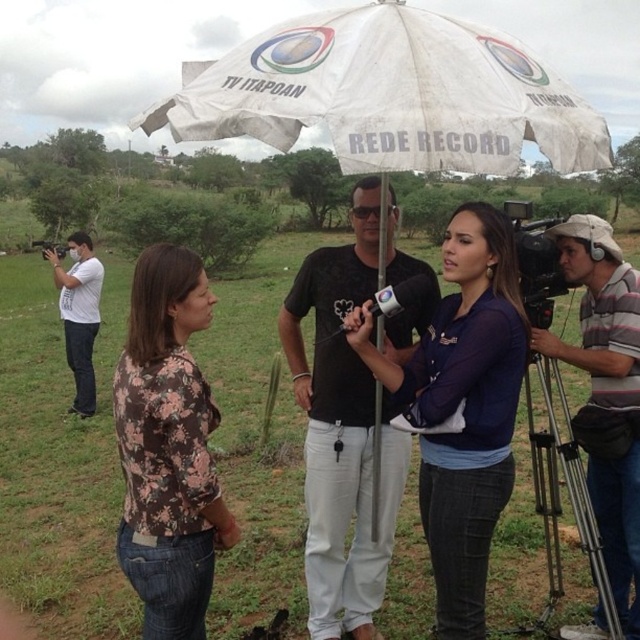
Question: Which of the following is the farthest from the observer?

Choices:
 (A) (506, 412)
 (B) (67, 248)
 (C) (365, 481)

Answer: (B)

Question: Is black matte t-shirt at center below black plastic video camera at left?

Choices:
 (A) no
 (B) yes

Answer: (B)

Question: Is white matte camera at left wider than black plastic video camera at right?

Choices:
 (A) no
 (B) yes

Answer: (B)

Question: Which point is closer to the camera?

Choices:
 (A) black plastic video camera at right
 (B) black plastic video camera at left

Answer: (A)

Question: Can you confirm if white fabric umbrella at center is positioned above black plastic video camera at left?

Choices:
 (A) no
 (B) yes

Answer: (A)

Question: Which object is closer to the camera taking this photo?

Choices:
 (A) black plastic video camera at left
 (B) white fabric umbrella at center

Answer: (B)